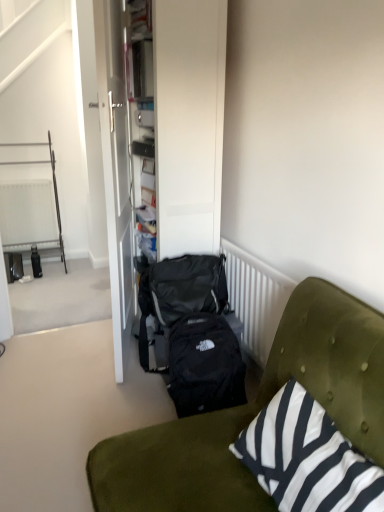
Locate an element on the screen. Image resolution: width=384 pixels, height=512 pixels. white glossy door at center is located at coordinates coord(115,167).

Image resolution: width=384 pixels, height=512 pixels. Describe the element at coordinates (254, 414) in the screenshot. I see `velvet green couch at lower right` at that location.

Measure the distance between white textured radiator at left, the second radiator viewed from the right, and camera.

white textured radiator at left, the second radiator viewed from the right, and camera are 3.53 meters apart from each other.

In order to face black and white striped cushion at lower right, should I rotate leftwards or rightwards?

You should look right and rotate roughly 15.179 degrees.

Locate an element on the screen. black fabric backpack at center, positioned as the 1th backpack in bottom-to-top order is located at coordinates (205, 365).

Image resolution: width=384 pixels, height=512 pixels. In order to click on white textured radiator at center, marked as the first radiator in a bottom-to-top arrangement in this screenshot , I will do `click(255, 298)`.

This screenshot has height=512, width=384. What do you see at coordinates (189, 122) in the screenshot?
I see `matte black suitcase at center` at bounding box center [189, 122].

The image size is (384, 512). What are the coordinates of `matte black bottle at left` in the screenshot? It's located at (36, 262).

Consider the image. Considering the relative sizes of black and white striped cushion at lower right and metal/textured rack at left in the image provided, is black and white striped cushion at lower right bigger than metal/textured rack at left?

No, black and white striped cushion at lower right is not bigger than metal/textured rack at left.

Which is closer, (x=345, y=510) or (x=8, y=248)?

The point (x=345, y=510) is in front.

Can you confirm if black and white striped cushion at lower right is positioned to the left of metal/textured rack at left?

Incorrect, black and white striped cushion at lower right is not on the left side of metal/textured rack at left.

How many degrees apart are the facing directions of black and white striped cushion at lower right and metal/textured rack at left?

90.6 degrees.

Are white textured radiator at left, which appears as the 1th radiator when viewed from the top, and velvet green couch at lower right making contact?

white textured radiator at left, which appears as the 1th radiator when viewed from the top, and velvet green couch at lower right are clearly separated.

Which object is thinner, white textured radiator at left, the 2th radiator positioned from the bottom, or velvet green couch at lower right?

white textured radiator at left, the 2th radiator positioned from the bottom, is thinner.

Is white textured radiator at left, marked as the 1th radiator in a left-to-right arrangement, oriented towards velvet green couch at lower right?

Yes, white textured radiator at left, marked as the 1th radiator in a left-to-right arrangement, is oriented towards velvet green couch at lower right.

Find the location of a particular element. This screenshot has height=512, width=384. door above the black fabric backpack at center, the second backpack positioned from the top (from the image's perspective) is located at coordinates (115, 167).

Is black fabric backpack at center, the second backpack positioned from the top, oriented towards white glossy door at center?

No, black fabric backpack at center, the second backpack positioned from the top, is not facing towards white glossy door at center.

Would you say black fabric backpack at center, positioned as the 1th backpack in bottom-to-top order, is inside or outside white glossy door at center?

black fabric backpack at center, positioned as the 1th backpack in bottom-to-top order, exists outside the volume of white glossy door at center.

From a real-world perspective, is black fabric backpack at center, positioned as the 1th backpack in bottom-to-top order, over white glossy door at center?

Actually, black fabric backpack at center, positioned as the 1th backpack in bottom-to-top order, is physically below white glossy door at center in the real world.

Between matte black suitcase at center and metal/textured rack at left, which one appears on the left side from the viewer's perspective?

From the viewer's perspective, metal/textured rack at left appears more on the left side.

Which point is more distant from viewer, (198, 46) or (11, 243)?

The point (11, 243) is more distant.

Who is more distant, matte black suitcase at center or metal/textured rack at left?

metal/textured rack at left is further from the camera.

Is black fabric backpack at center, the second backpack positioned from the top, in front of or behind matte black bottle at left in the image?

black fabric backpack at center, the second backpack positioned from the top, is positioned closer to the viewer than matte black bottle at left.

Which is in front, point (210, 391) or point (36, 248)?

Positioned in front is point (210, 391).

Could matte black bottle at left be considered to be inside black fabric backpack at center, the second backpack positioned from the top?

That's incorrect, matte black bottle at left is not inside black fabric backpack at center, the second backpack positioned from the top.

From their relative heights in the image, would you say metal/textured rack at left is taller or shorter than white glossy door at center?

metal/textured rack at left is shorter than white glossy door at center.

Consider the image. Which of these two, metal/textured rack at left or white glossy door at center, is smaller?

With smaller size is white glossy door at center.

Considering the sizes of metal/textured rack at left and white glossy door at center in the image, is metal/textured rack at left wider or thinner than white glossy door at center?

Clearly, metal/textured rack at left has more width compared to white glossy door at center.

Is black fabric backpack at center, which is the 2th backpack from bottom to top, oriented away from black and white striped cushion at lower right?

black fabric backpack at center, which is the 2th backpack from bottom to top, is not turned away from black and white striped cushion at lower right.

How many degrees apart are the facing directions of black fabric backpack at center, which ranks as the first backpack in top-to-bottom order, and black and white striped cushion at lower right?

The angular difference between black fabric backpack at center, which ranks as the first backpack in top-to-bottom order, and black and white striped cushion at lower right is 86.4 degrees.

From the image's perspective, between black fabric backpack at center, which is the 2th backpack from bottom to top, and black and white striped cushion at lower right, who is located below?

black and white striped cushion at lower right.

Which is in front, point (183, 279) or point (363, 473)?

Point (363, 473)

Locate an element on the screen. The height and width of the screenshot is (512, 384). cabinetry above the black and white striped cushion at lower right (from the image's perspective) is located at coordinates (54, 194).

The width and height of the screenshot is (384, 512). There is a velvet green couch at lower right. Find the location of `radiator above it (from a real-world perspective)`. radiator above it (from a real-world perspective) is located at coordinates (27, 213).

From the image, which object appears to be nearer to black and white striped cushion at lower right, white textured radiator at left, which appears as the 1th radiator when viewed from the top, or white textured radiator at center, which is counted as the 2th radiator, starting from the left?

The object closer to black and white striped cushion at lower right is white textured radiator at center, which is counted as the 2th radiator, starting from the left.

Considering their positions, is white glossy door at center positioned closer to black fabric backpack at center, which is the 2th backpack from bottom to top, than matte black bottle at left?

white glossy door at center is closer to black fabric backpack at center, which is the 2th backpack from bottom to top.

Based on their spatial positions, is white textured radiator at center, marked as the second radiator in a back-to-front arrangement, or velvet green couch at lower right further from metal/textured rack at left?

The object further to metal/textured rack at left is velvet green couch at lower right.

Based on their spatial positions, is black fabric backpack at center, the second backpack positioned from the top, or black and white striped cushion at lower right further from white textured radiator at center, marked as the second radiator in a back-to-front arrangement?

Among the two, black and white striped cushion at lower right is located further to white textured radiator at center, marked as the second radiator in a back-to-front arrangement.

Which object lies further to the anchor point white textured radiator at left, which appears as the 1th radiator when viewed from the top, black fabric backpack at center, the second backpack positioned from the top, or white glossy door at center?

Based on the image, black fabric backpack at center, the second backpack positioned from the top, appears to be further to white textured radiator at left, which appears as the 1th radiator when viewed from the top.

Estimate the real-world distances between objects in this image. Which object is closer to white textured radiator at left, the second radiator viewed from the right, black and white striped cushion at lower right or white textured radiator at center, marked as the first radiator in a bottom-to-top arrangement?

white textured radiator at center, marked as the first radiator in a bottom-to-top arrangement, is closer to white textured radiator at left, the second radiator viewed from the right.

When comparing their distances from white textured radiator at center, which is the first radiator from right to left, does black and white striped cushion at lower right or black fabric backpack at center, which is the 2th backpack from bottom to top, seem further?

black and white striped cushion at lower right lies further to white textured radiator at center, which is the first radiator from right to left, than the other object.

Which object lies further to the anchor point velvet green couch at lower right, white textured radiator at center, which is counted as the 2th radiator, starting from the left, or white textured radiator at left, arranged as the 1th radiator when viewed from the back?

Based on the image, white textured radiator at left, arranged as the 1th radiator when viewed from the back, appears to be further to velvet green couch at lower right.

Where is `backpack positioned between velvet green couch at lower right and white textured radiator at center, which is counted as the 2th radiator, starting from the left, from near to far`? This screenshot has width=384, height=512. backpack positioned between velvet green couch at lower right and white textured radiator at center, which is counted as the 2th radiator, starting from the left, from near to far is located at coordinates (205, 365).

At what (x,y) coordinates should I click in order to perform the action: click on armoire between metal/textured rack at left and white textured radiator at center, positioned as the second radiator in top-to-bottom order, in the horizontal direction. Please return your answer as a coordinate pair (x, y). Looking at the image, I should click on (189, 122).

Find the location of a particular element. door positioned between black and white striped cushion at lower right and matte black suitcase at center from near to far is located at coordinates (115, 167).

Where is `pillow between velvet green couch at lower right and black fabric backpack at center, which ranks as the first backpack in top-to-bottom order, along the z-axis`? The height and width of the screenshot is (512, 384). pillow between velvet green couch at lower right and black fabric backpack at center, which ranks as the first backpack in top-to-bottom order, along the z-axis is located at coordinates (307, 457).